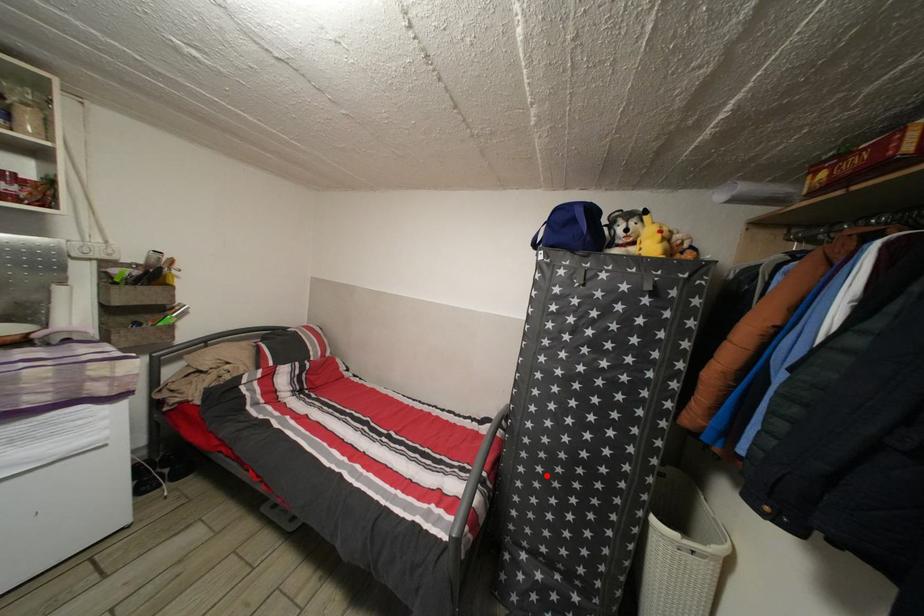
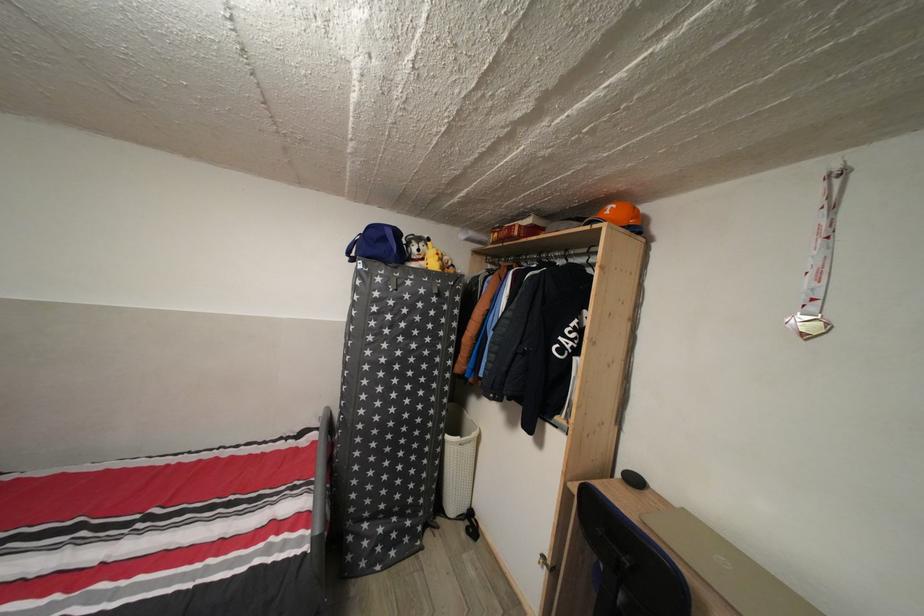
Where in the second image is the point corresponding to the highlighted location from the first image?

(380, 451)